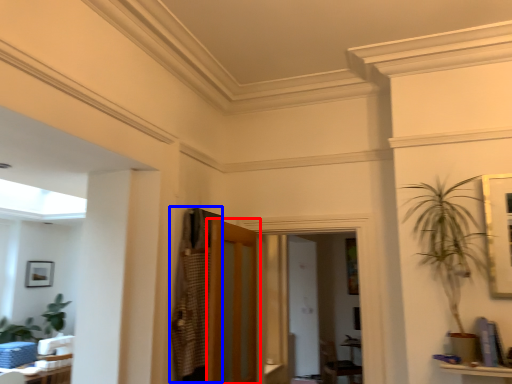
Question: Which object is closer to the camera taking this photo, door (highlighted by a red box) or armoire (highlighted by a blue box)?

Choices:
 (A) door
 (B) armoire

Answer: (A)